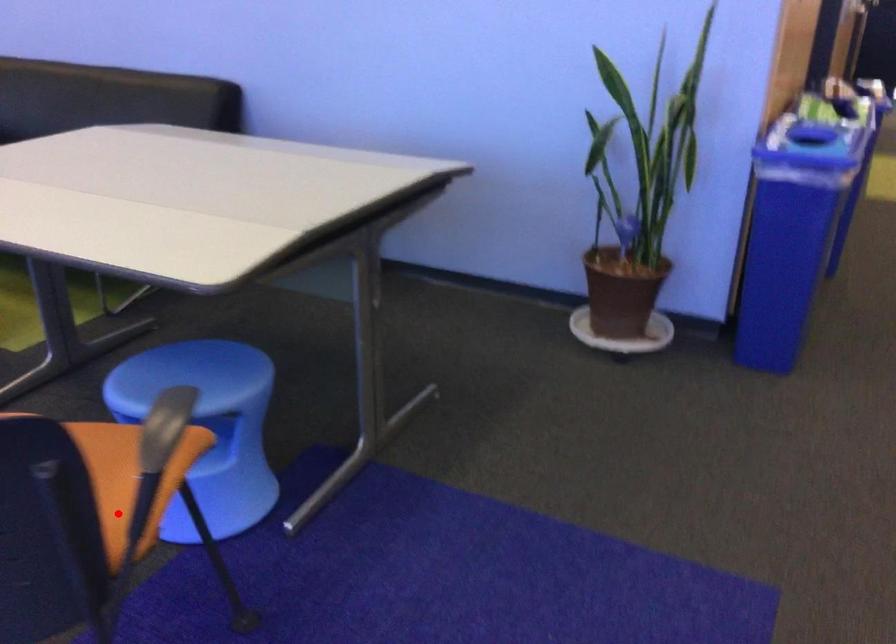
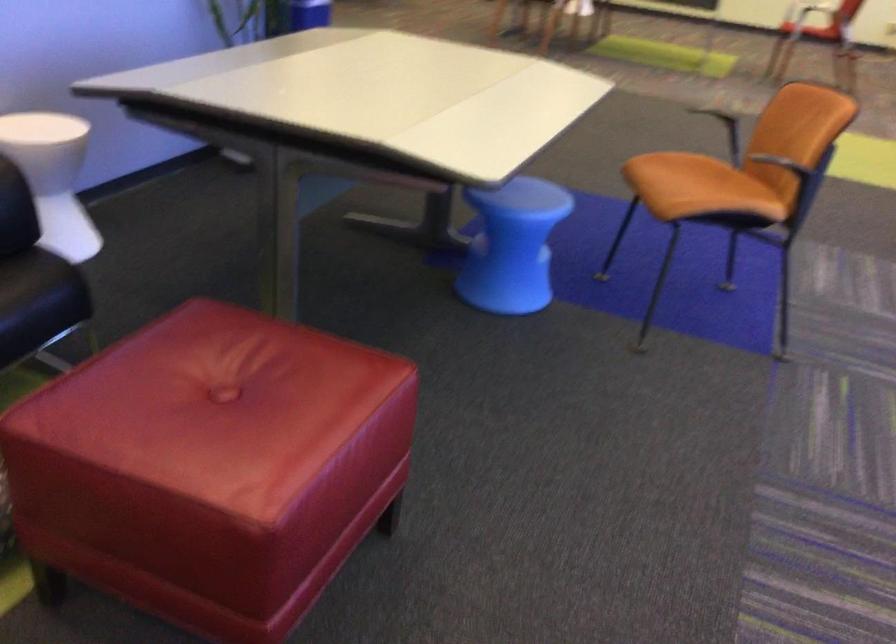
Where in the second image is the point corresponding to the highlighted location from the first image?

(711, 173)